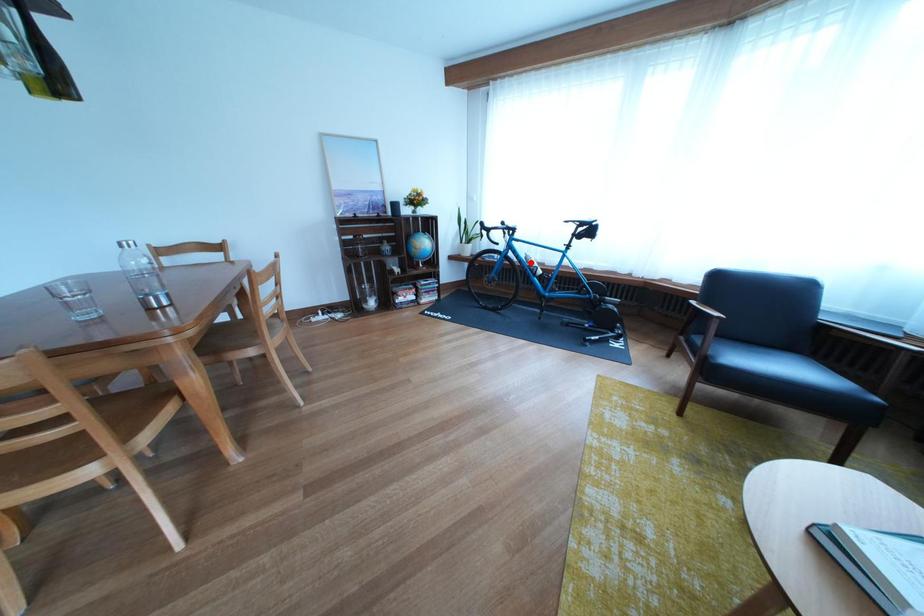
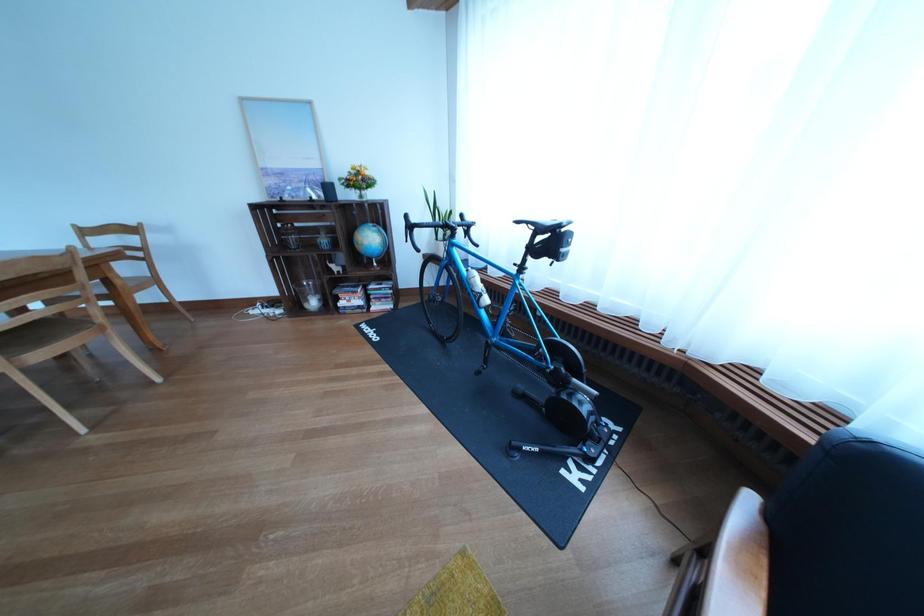
In the second image, find the point that corresponds to the highlighted location in the first image.

(470, 277)